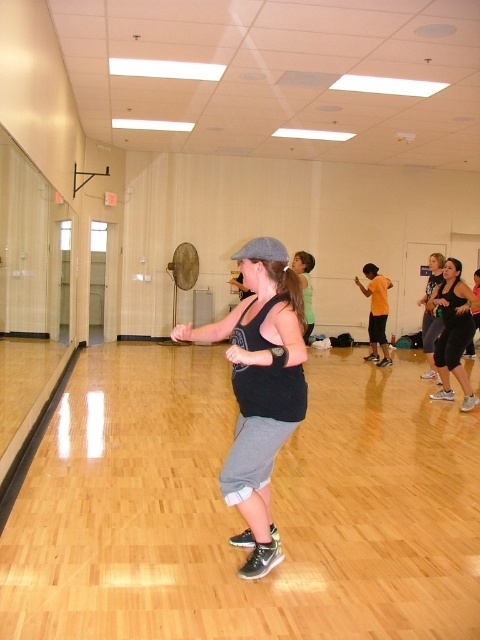
Is black matte tank top at center smaller than black matte leggings at lower right?

Indeed, black matte tank top at center has a smaller size compared to black matte leggings at lower right.

Between point (298, 289) and point (453, 259), which one is positioned behind?

Positioned behind is point (453, 259).

Is point (295, 394) farther from viewer compared to point (437, 355)?

No, it is not.

The height and width of the screenshot is (640, 480). I want to click on black matte tank top at center, so click(260, 388).